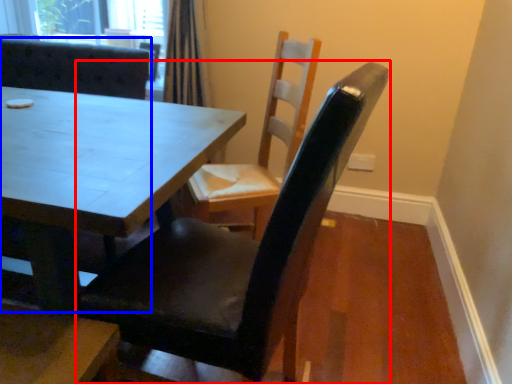
Question: Which point is closer to the camera, chair (highlighted by a red box) or chair (highlighted by a blue box)?

Choices:
 (A) chair
 (B) chair

Answer: (A)